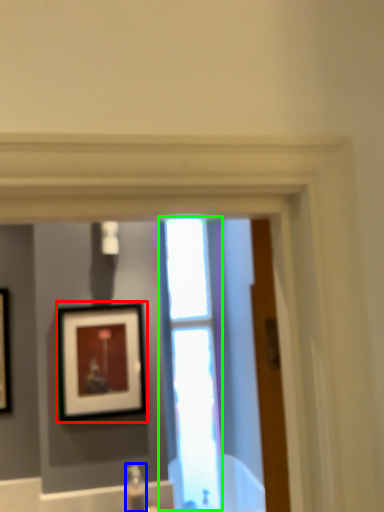
Question: Estimate the real-world distances between objects in this image. Which object is farther from picture frame (highlighted by a red box), plumbing fixture (highlighted by a blue box) or window (highlighted by a green box)?

Choices:
 (A) plumbing fixture
 (B) window

Answer: (A)